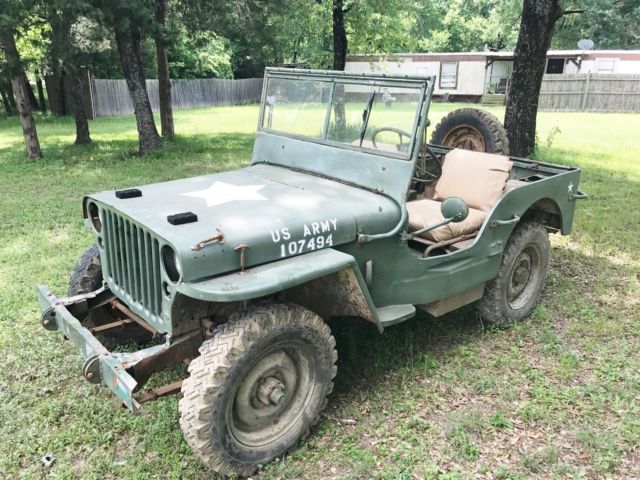
Locate an element on the screen. hood is located at coordinates (230, 210).